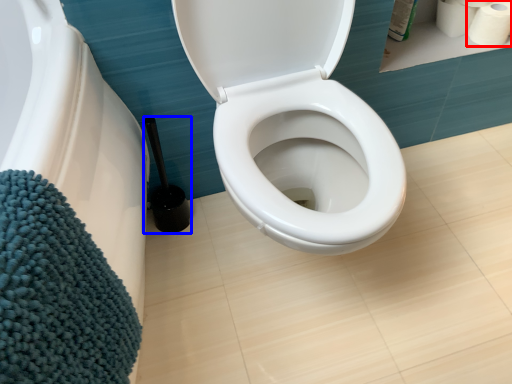
Question: Which point is further to the camera, toilet paper (highlighted by a red box) or brush (highlighted by a blue box)?

Choices:
 (A) toilet paper
 (B) brush

Answer: (A)